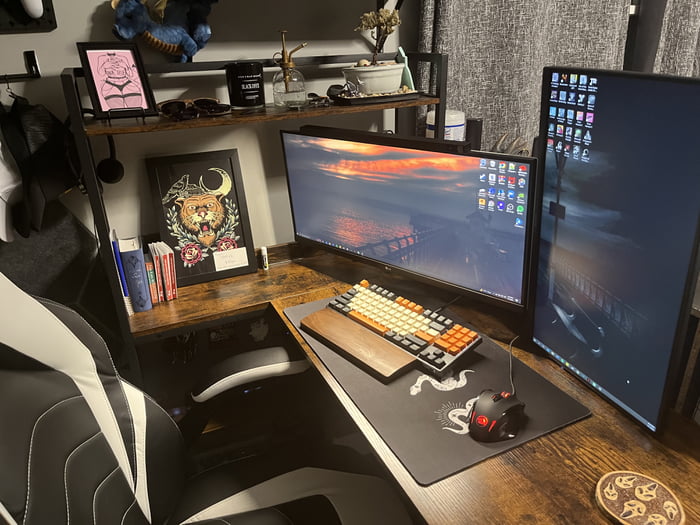
Find the location of a particular element. wooden shelf is located at coordinates (248, 117).